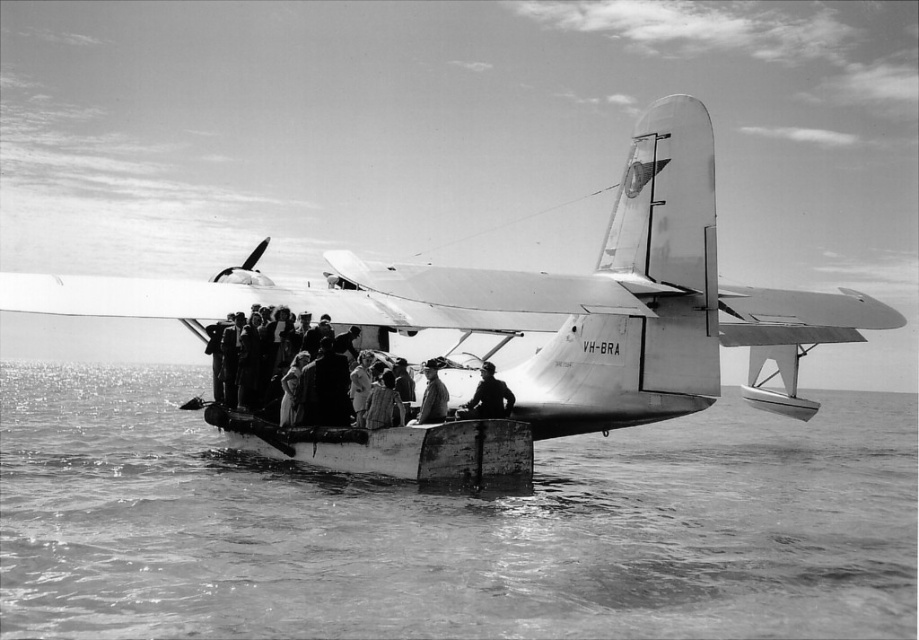
Which of these two, smooth water at lower center or dark fabric jacket at center, stands shorter?

With less height is dark fabric jacket at center.

Does smooth water at lower center appear under dark fabric jacket at center?

Yes.

Measure the distance between point (2, 566) and camera.

Point (2, 566) is 72.45 meters from camera.

Locate an element on the screen. smooth water at lower center is located at coordinates (449, 525).

Can you confirm if wooden boat at center is bigger than smooth leather jacket at center?

Yes, wooden boat at center is bigger than smooth leather jacket at center.

Between wooden boat at center and smooth leather jacket at center, which one is positioned higher?

smooth leather jacket at center

This screenshot has height=640, width=919. Find the location of `wooden boat at center`. wooden boat at center is located at coordinates (389, 448).

Between dark fabric jacket at center and smooth leather jacket at center, which one appears on the right side from the viewer's perspective?

dark fabric jacket at center is more to the right.

Does dark fabric jacket at center appear under smooth leather jacket at center?

Incorrect, dark fabric jacket at center is not positioned below smooth leather jacket at center.

Where is `dark fabric jacket at center`? The height and width of the screenshot is (640, 919). dark fabric jacket at center is located at coordinates (488, 396).